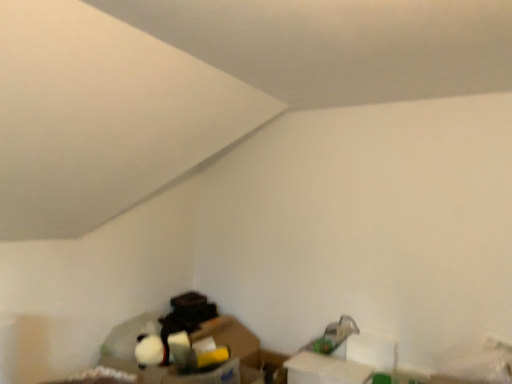
Describe the element at coordinates (324, 370) in the screenshot. I see `white cardboard box at lower right` at that location.

The width and height of the screenshot is (512, 384). I want to click on white cardboard box at lower right, so click(x=324, y=370).

I want to click on white cardboard box at lower right, so click(324, 370).